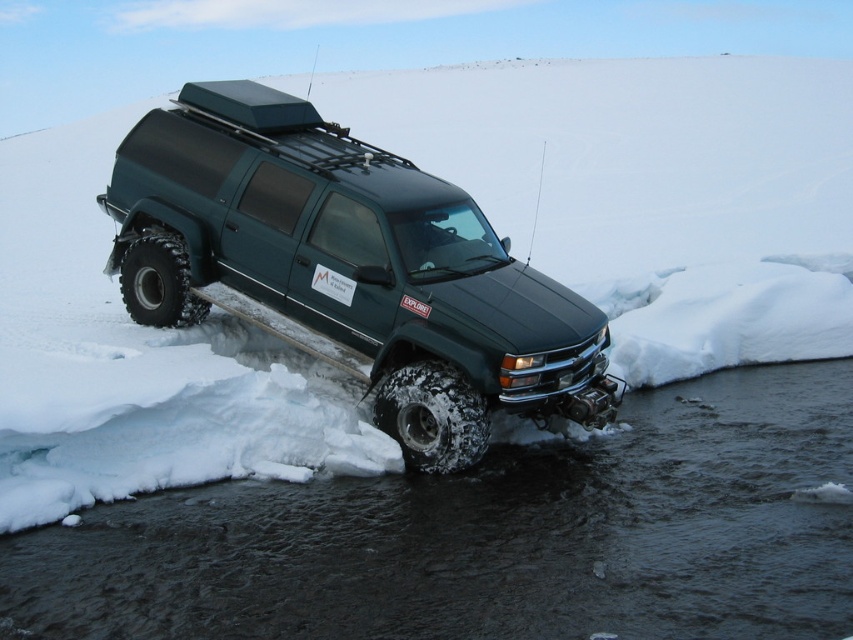
Question: Among these objects, which one is farthest from the camera?

Choices:
 (A) dark gray water at lower center
 (B) green matte truck at center

Answer: (B)

Question: Can you confirm if dark gray water at lower center is positioned above green matte truck at center?

Choices:
 (A) yes
 (B) no

Answer: (B)

Question: Which point is closer to the camera?

Choices:
 (A) (364, 157)
 (B) (347, 518)

Answer: (B)

Question: Which of the following is the farthest from the observer?

Choices:
 (A) tap(384, 496)
 (B) tap(161, 285)

Answer: (B)

Question: Can you confirm if dark gray water at lower center is positioned above green matte truck at center?

Choices:
 (A) yes
 (B) no

Answer: (B)

Question: Does dark gray water at lower center lie behind green matte truck at center?

Choices:
 (A) yes
 (B) no

Answer: (B)